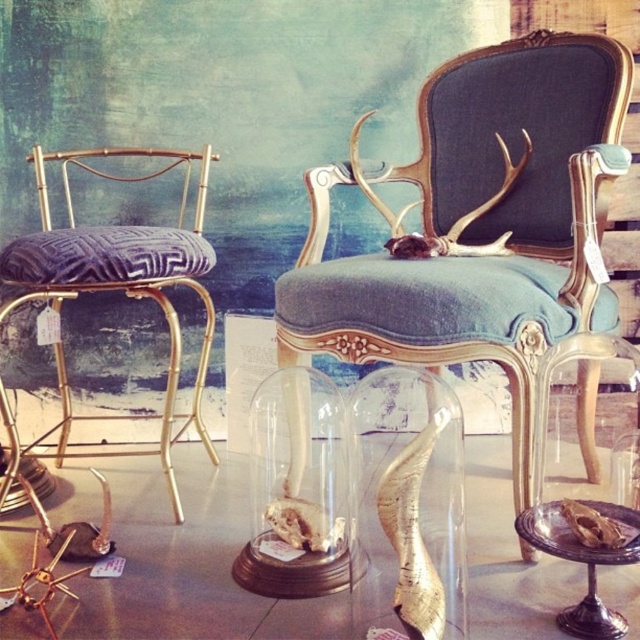
Is gold wood armchair with antlers at center to the left of gold metallic stool at left from the viewer's perspective?

In fact, gold wood armchair with antlers at center is to the right of gold metallic stool at left.

Between point (605, 163) and point (170, 467), which one is positioned in front?

Point (605, 163)

Is point (582, 276) positioned in front of point (160, 282)?

Yes, point (582, 276) is in front of point (160, 282).

The width and height of the screenshot is (640, 640). Find the location of `gold wood armchair with antlers at center`. gold wood armchair with antlers at center is located at coordinates (480, 224).

Identify the location of gold wood armchair with antlers at center. This screenshot has width=640, height=640. (480, 224).

Between point (588, 136) and point (138, 621), which one is positioned in front?

Positioned in front is point (138, 621).

Where is `gold wood armchair with antlers at center`? gold wood armchair with antlers at center is located at coordinates (480, 224).

Is transparent glass table at center taller than transparent glass skull at lower right?

Yes.

Looking at this image, who is positioned more to the left, transparent glass table at center or transparent glass skull at lower right?

transparent glass table at center

Between point (172, 609) and point (595, 547), which one is positioned in front?

Positioned in front is point (595, 547).

The height and width of the screenshot is (640, 640). In order to click on transparent glass table at center in this screenshot , I will do `click(186, 563)`.